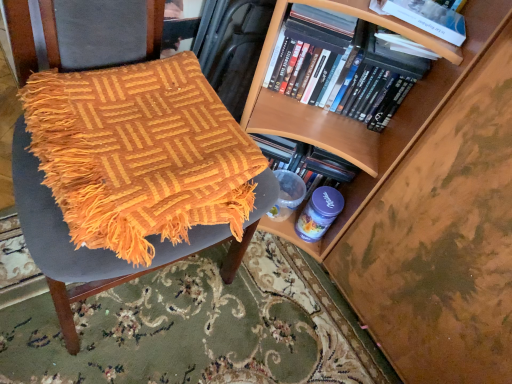
Question: Is black matte dvds at upper right, the first book positioned from the back, smaller than hardcover book at upper right, which is the 2th book from back to front?

Choices:
 (A) no
 (B) yes

Answer: (A)

Question: Considering the relative positions of black matte dvds at upper right, arranged as the second book when viewed from the front, and hardcover book at upper right, which appears as the 1th book when viewed from the front, in the image provided, is black matte dvds at upper right, arranged as the second book when viewed from the front, in front of hardcover book at upper right, which appears as the 1th book when viewed from the front,?

Choices:
 (A) no
 (B) yes

Answer: (A)

Question: Can you confirm if black matte dvds at upper right, the first book positioned from the back, is positioned to the right of hardcover book at upper right, which appears as the 1th book when viewed from the front?

Choices:
 (A) no
 (B) yes

Answer: (A)

Question: From the image's perspective, is black matte dvds at upper right, the first book positioned from the back, on top of hardcover book at upper right, which is the 2th book from back to front?

Choices:
 (A) yes
 (B) no

Answer: (B)

Question: Is black matte dvds at upper right, the first book positioned from the back, oriented away from hardcover book at upper right, which is the 2th book from back to front?

Choices:
 (A) yes
 (B) no

Answer: (B)

Question: From the image's perspective, relative to black matte dvds at upper right, arranged as the second book when viewed from the front, is hardcover book at upper right above or below?

Choices:
 (A) below
 (B) above

Answer: (B)

Question: Considering the positions of hardcover book at upper right and black matte dvds at upper right, arranged as the second book when viewed from the front, in the image, is hardcover book at upper right bigger or smaller than black matte dvds at upper right, arranged as the second book when viewed from the front,?

Choices:
 (A) small
 (B) big

Answer: (A)

Question: Do you think hardcover book at upper right is within black matte dvds at upper right, arranged as the second book when viewed from the front, or outside of it?

Choices:
 (A) outside
 (B) inside

Answer: (A)

Question: Considering the positions of hardcover book at upper right and black matte dvds at upper right, the first book positioned from the back, in the image, is hardcover book at upper right wider or thinner than black matte dvds at upper right, the first book positioned from the back,?

Choices:
 (A) thin
 (B) wide

Answer: (B)

Question: Would you say hardcover book at upper right, which is the 2th book from back to front, is to the left or to the right of orange woven blanket at left in the picture?

Choices:
 (A) right
 (B) left

Answer: (A)

Question: From a real-world perspective, is hardcover book at upper right, which appears as the 1th book when viewed from the front, above or below orange woven blanket at left?

Choices:
 (A) below
 (B) above

Answer: (B)

Question: Is point (452, 36) closer or farther from the camera than point (65, 309)?

Choices:
 (A) farther
 (B) closer

Answer: (B)

Question: Is hardcover book at upper right, which appears as the 1th book when viewed from the front, inside or outside of orange woven blanket at left?

Choices:
 (A) outside
 (B) inside

Answer: (A)

Question: From a real-world perspective, is black matte dvds at upper right, the first book positioned from the back, positioned above or below orange woven blanket at left?

Choices:
 (A) below
 (B) above

Answer: (B)

Question: In terms of width, does black matte dvds at upper right, arranged as the second book when viewed from the front, look wider or thinner when compared to orange woven blanket at left?

Choices:
 (A) wide
 (B) thin

Answer: (B)